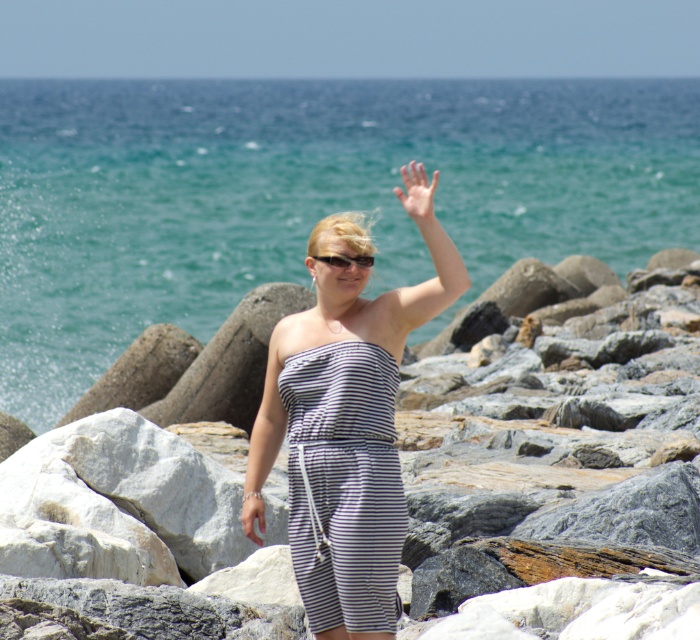
You are a photographer capturing the scene of a person on a rocky shoreline. You notice two hands in the image. The person is wearing a sleeveless dress. Which hand, the smooth skin hand at upper center or the smooth skin hand at center, appears bigger in the photo?

The smooth skin hand at upper center appears bigger in the photo because it is larger in size than the smooth skin hand at center according to the description.

You are a photographer taking a portrait of the person on the rocky shoreline. You notice the smooth skin hand at center and the black plastic sunglasses at center. Which object should you adjust to ensure the hand is visible in the frame?

The black plastic sunglasses at center should be adjusted because the smooth skin hand at center is to the left of them, so moving the sunglasses slightly to the right would allow the hand to remain visible in the frame.